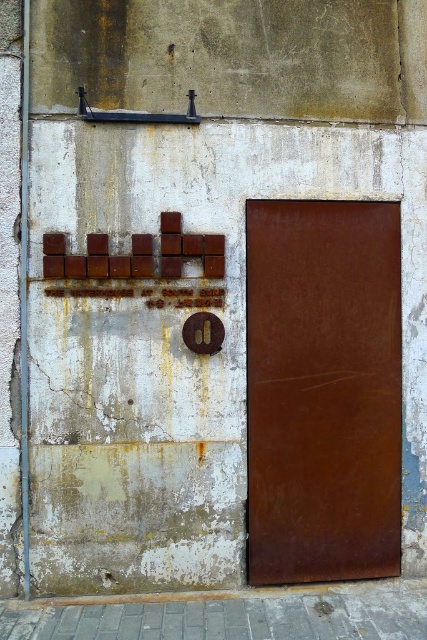
Question: Is rusty metal door at center smaller than rusty metal door at right?

Choices:
 (A) yes
 (B) no

Answer: (B)

Question: Is rusty metal door at center positioned before rusty metal door at right?

Choices:
 (A) yes
 (B) no

Answer: (A)

Question: Does rusty metal door at center come behind rusty metal door at right?

Choices:
 (A) yes
 (B) no

Answer: (B)

Question: Which point is closer to the camera taking this photo?

Choices:
 (A) (49, 417)
 (B) (283, 221)

Answer: (A)

Question: Which point is farther to the camera?

Choices:
 (A) rusty metal door at right
 (B) rusty metal door at center

Answer: (A)